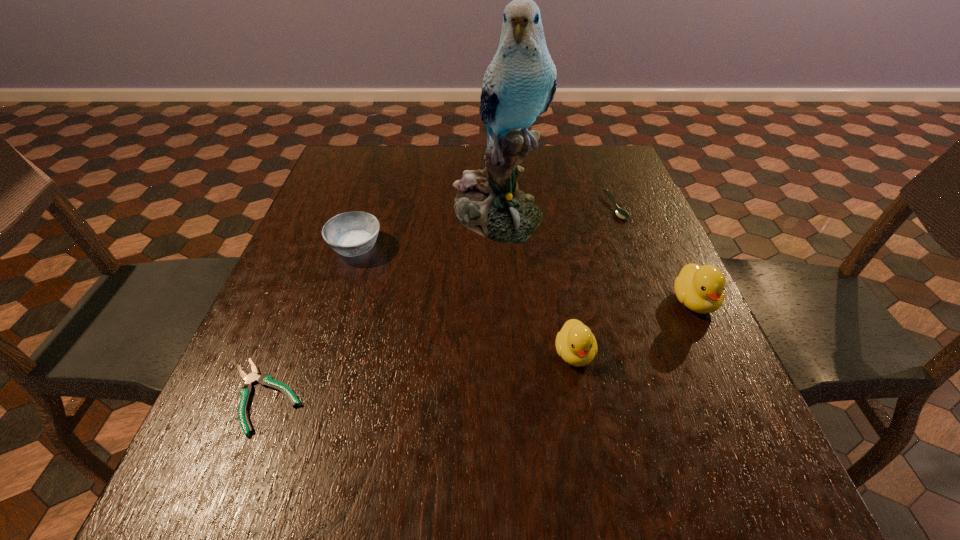
The height and width of the screenshot is (540, 960). I want to click on vacant space located on the beak of the fifth shortest object, so point(716,348).

You are a GUI agent. You are given a task and a screenshot of the screen. Output one action in this format:
    pyautogui.click(x=<x>, y=<y>)
    Task: Click on the free location located 0.230m on the face of the tallest object
    The width and height of the screenshot is (960, 540).
    Given the screenshot: What is the action you would take?
    pyautogui.click(x=502, y=323)

The height and width of the screenshot is (540, 960). Find the location of `free space located on the front of the ashtray`. free space located on the front of the ashtray is located at coordinates (340, 298).

At what (x,y) coordinates should I click in order to perform the action: click on free region located 0.230m on the back of the soupspoon. Please return your answer as a coordinate pair (x, y). The height and width of the screenshot is (540, 960). Looking at the image, I should click on (595, 153).

You are a GUI agent. You are given a task and a screenshot of the screen. Output one action in this format:
    pyautogui.click(x=<x>, y=<y>)
    Task: Click on the free space located on the back of the pliers
    The width and height of the screenshot is (960, 540).
    Given the screenshot: What is the action you would take?
    pyautogui.click(x=326, y=239)

Where is `object that is at the far edge`? object that is at the far edge is located at coordinates (519, 85).

Find the location of a particular element. The height and width of the screenshot is (540, 960). object at the near edge is located at coordinates (246, 390).

This screenshot has height=540, width=960. I want to click on ashtray at the left edge, so 354,233.

The width and height of the screenshot is (960, 540). I want to click on pliers positioned at the left edge, so click(x=246, y=390).

At what (x,y) coordinates should I click in order to perform the action: click on duckling situated at the right edge. Please return your answer as a coordinate pair (x, y). Image resolution: width=960 pixels, height=540 pixels. Looking at the image, I should click on click(700, 288).